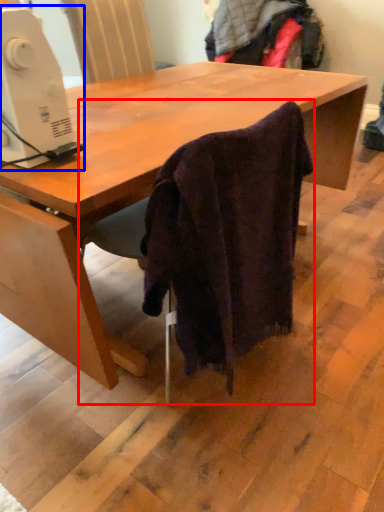
Question: Among these objects, which one is nearest to the camera, chair (highlighted by a red box) or sewing machine (highlighted by a blue box)?

Choices:
 (A) chair
 (B) sewing machine

Answer: (B)